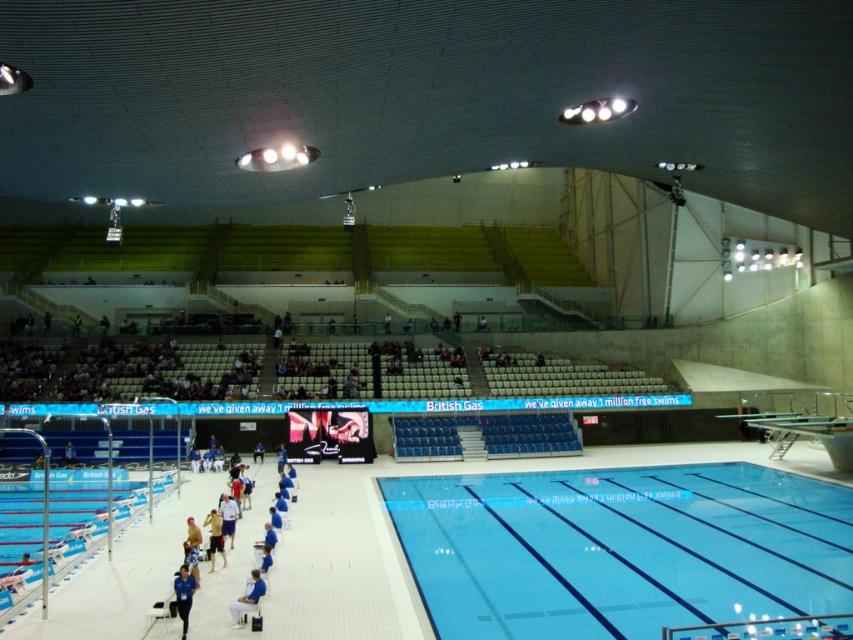
You are a lifeguard standing at the edge of the pool. You notice a swimmer wearing a blue fabric shirt at lower center and the clear blue water at center. Where is the swimmer located relative to the water?

The swimmer wearing the blue fabric shirt at lower center is positioned above the clear blue water at center since the water is under the shirt.

You are standing at the origin point of the coordinate system in the image. You want to walk to the blue fabric shirt at lower center. What are the coordinates you need to move to?

The coordinates you need to move to are point (183,595).

You are a swimmer preparing for a race and need to sit down quickly. You see a blue fabric chair at lower center and light blue fabric shorts at center. Which one is shorter and thus easier to sit on?

The blue fabric chair at lower center is shorter than light blue fabric shorts at center, so it is easier to sit on.